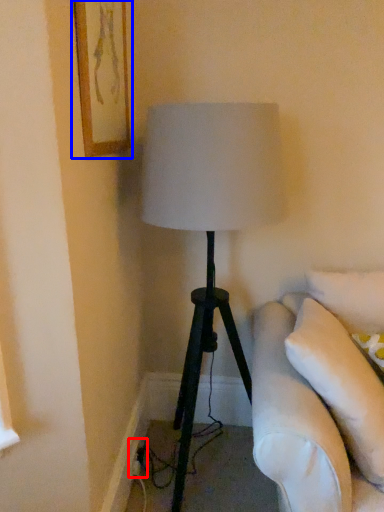
Question: Which point is further to the camera, electric outlet (highlighted by a red box) or picture frame (highlighted by a blue box)?

Choices:
 (A) electric outlet
 (B) picture frame

Answer: (A)